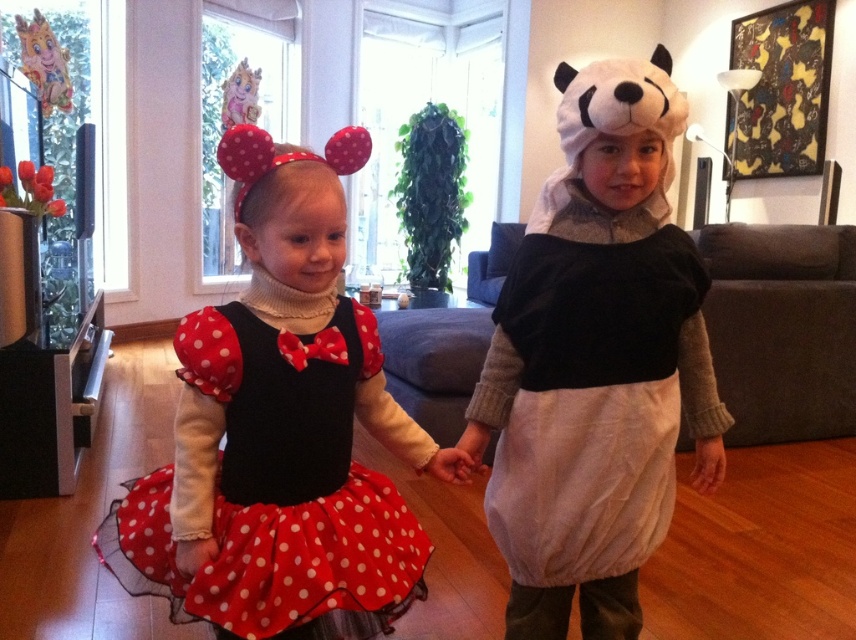
Question: Which of the following is the closest to the observer?

Choices:
 (A) white cotton dress at center
 (B) matte black dress at center
 (C) red polka dot tulle dress at center

Answer: (C)

Question: Among these points, which one is nearest to the camera?

Choices:
 (A) (635, 285)
 (B) (408, 538)

Answer: (B)

Question: Based on their relative distances, which object is farther from the paper cutout animal at upper left?

Choices:
 (A) matte black dress at center
 (B) red polka dot tulle dress at center
 (C) white cotton dress at center

Answer: (C)

Question: Can you confirm if matte black dress at center is thinner than paper cutout animal at upper left?

Choices:
 (A) yes
 (B) no

Answer: (B)

Question: Is white cotton dress at center further to camera compared to pastel pink plush toy at upper left?

Choices:
 (A) no
 (B) yes

Answer: (A)

Question: Can you confirm if paper cutout animal at upper left is bigger than pastel pink plush toy at upper left?

Choices:
 (A) yes
 (B) no

Answer: (B)